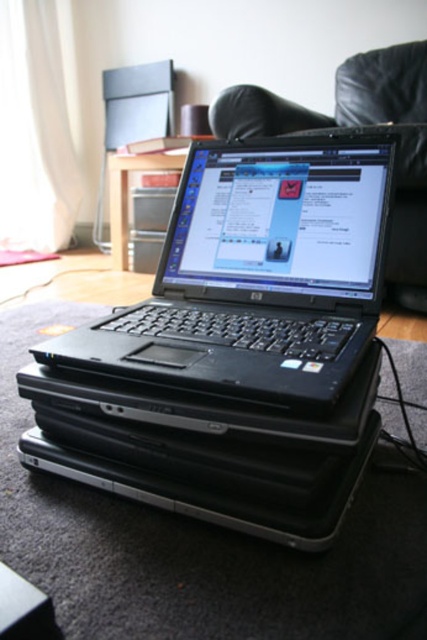
Question: Which object is the closest to the black leather couch at upper center?

Choices:
 (A) black matte laptop at center
 (B) black plastic laptop at center

Answer: (A)

Question: Is black matte laptop at center positioned before black plastic laptop at center?

Choices:
 (A) yes
 (B) no

Answer: (A)

Question: Which object appears farthest from the camera in this image?

Choices:
 (A) black leather couch at upper center
 (B) black matte laptop at center

Answer: (A)

Question: Does black matte laptop at center come behind black plastic laptop at center?

Choices:
 (A) no
 (B) yes

Answer: (A)

Question: Is black matte laptop at center wider than black plastic laptop at center?

Choices:
 (A) yes
 (B) no

Answer: (A)

Question: Which point is farther to the camera?

Choices:
 (A) (222, 108)
 (B) (193, 513)

Answer: (A)